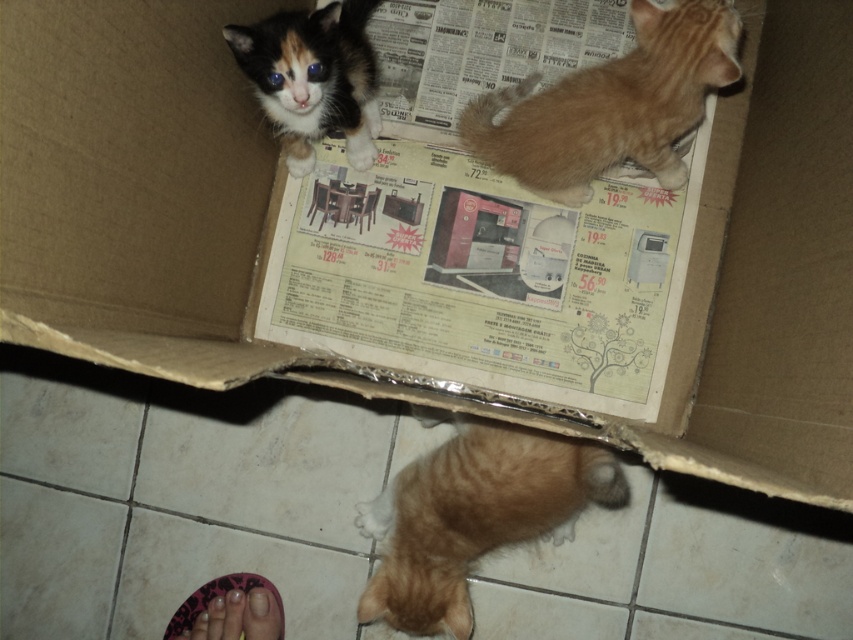
Can you confirm if orange fur cat at lower center is shorter than orange fur kitten at upper right?

Yes.

Between orange fur cat at lower center and orange fur kitten at upper right, which one appears on the right side from the viewer's perspective?

orange fur kitten at upper right

Is point (469, 419) positioned in front of point (460, 116)?

Yes, it is.

Where is `orange fur cat at lower center`? orange fur cat at lower center is located at coordinates (473, 515).

Who is higher up, calico fur kitten at upper center or pink fabric foot at lower left?

calico fur kitten at upper center is higher up.

Can you confirm if calico fur kitten at upper center is taller than pink fabric foot at lower left?

Yes, calico fur kitten at upper center is taller than pink fabric foot at lower left.

Where is `calico fur kitten at upper center`? calico fur kitten at upper center is located at coordinates (312, 77).

In the scene shown: Is orange fur cat at lower center thinner than calico fur kitten at upper center?

No.

Identify the location of orange fur cat at lower center. (473, 515).